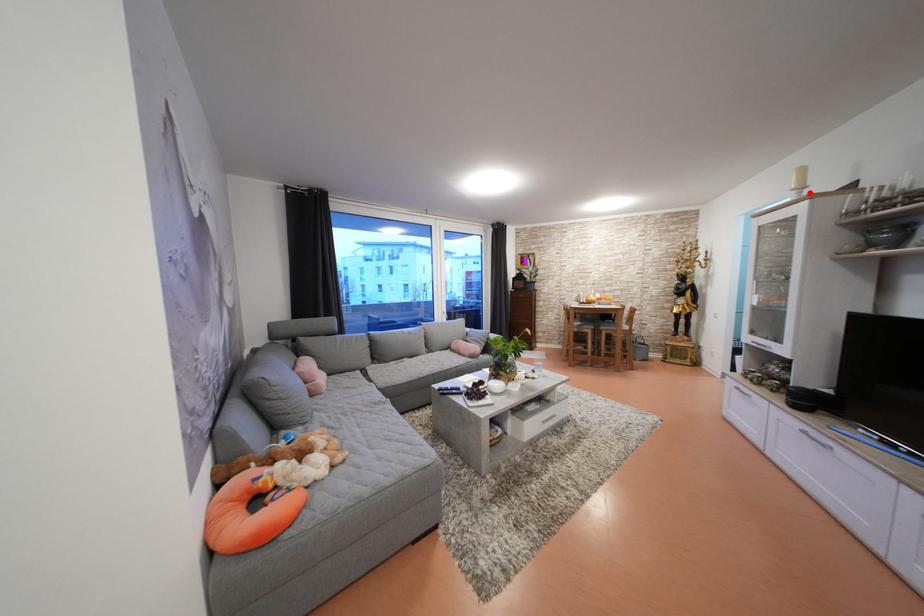
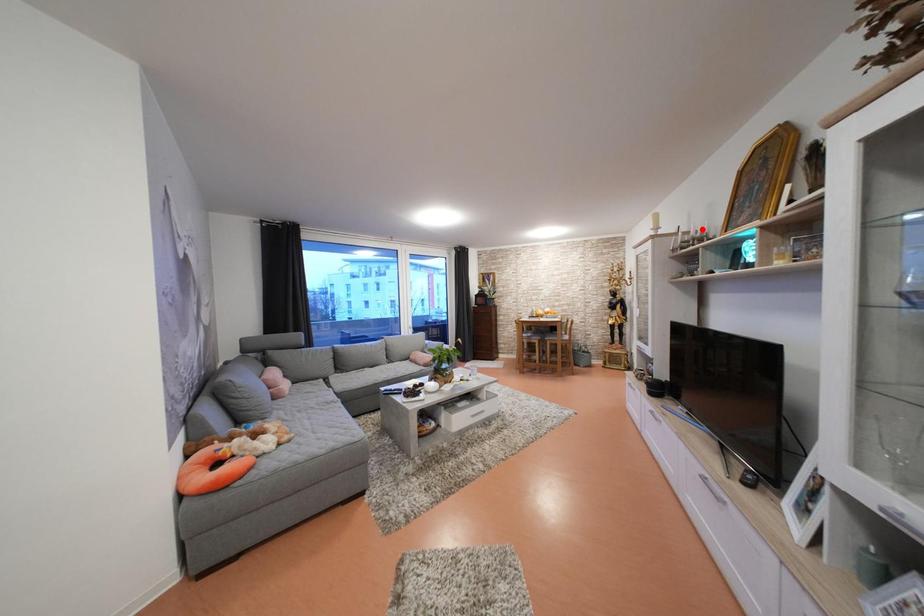
I am providing you with two images of the same scene from different viewpoints. A red point is marked on the first image and another point is marked on the second image. Are the points marked in image1 and image2 representing the same 3D position?

No